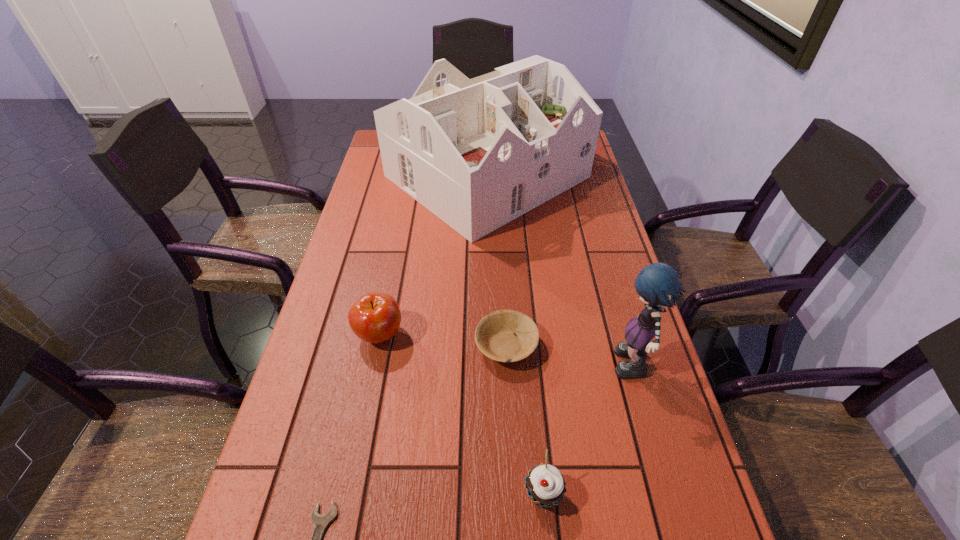
The width and height of the screenshot is (960, 540). I want to click on the farthest object, so click(x=478, y=153).

Locate an element on the screen. Image resolution: width=960 pixels, height=540 pixels. rag doll is located at coordinates (657, 284).

The height and width of the screenshot is (540, 960). I want to click on apple, so [x=375, y=317].

The height and width of the screenshot is (540, 960). What are the coordinates of `cupcake` in the screenshot? It's located at (546, 486).

Locate an element on the screen. The width and height of the screenshot is (960, 540). bowl is located at coordinates (506, 335).

At what (x,y) coordinates should I click in order to perform the action: click on vacant space located 0.230m on the front of the farthest object. Please return your answer as a coordinate pair (x, y). This screenshot has width=960, height=540. Looking at the image, I should click on (490, 303).

You are a GUI agent. You are given a task and a screenshot of the screen. Output one action in this format:
    pyautogui.click(x=<x>, y=<y>)
    Task: Click on the vacant space located on the front-facing side of the rag doll
    
    Given the screenshot: What is the action you would take?
    pyautogui.click(x=575, y=370)

This screenshot has width=960, height=540. Identify the location of vacant space located on the front-facing side of the rag doll. (579, 370).

You are a GUI agent. You are given a task and a screenshot of the screen. Output one action in this format:
    pyautogui.click(x=<x>, y=<y>)
    Task: Click on the free spot located 0.300m on the front-facing side of the rag doll
    The width and height of the screenshot is (960, 540).
    Given the screenshot: What is the action you would take?
    pyautogui.click(x=474, y=370)

This screenshot has width=960, height=540. I want to click on vacant position located on the right of the apple, so click(532, 334).